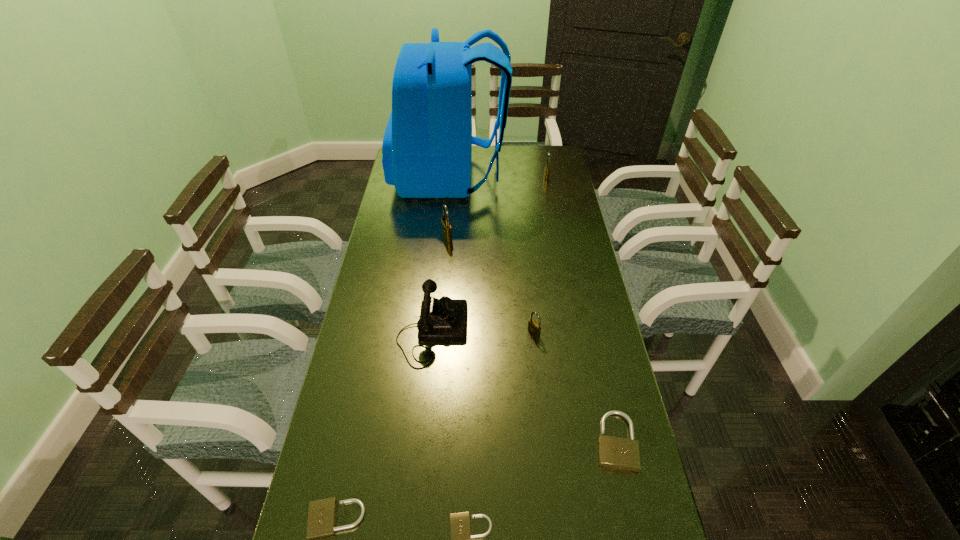
Where is `object at the far left corner`? The height and width of the screenshot is (540, 960). object at the far left corner is located at coordinates (427, 146).

Where is `vacant space at the left edge of the desktop`? This screenshot has width=960, height=540. vacant space at the left edge of the desktop is located at coordinates (388, 303).

Identify the location of free space at the right edge of the desktop. Image resolution: width=960 pixels, height=540 pixels. (543, 195).

You are a GUI agent. You are given a task and a screenshot of the screen. Output one action in this format:
    pyautogui.click(x=<x>, y=<y>)
    Task: Click on the free space that is in between the telephone and the leftmost brass padlock
    
    Given the screenshot: What is the action you would take?
    pyautogui.click(x=440, y=284)

Locate an element on the screen. The height and width of the screenshot is (540, 960). empty space between the third farthest object and the farthest brass padlock is located at coordinates (497, 207).

Find the location of a particular element. This screenshot has height=540, width=960. object that is the second closest to the third farthest padlock is located at coordinates (619, 453).

I want to click on object that can be found as the third closest to the second brass padlock from left to right, so click(446, 226).

Locate an element on the screen. The width and height of the screenshot is (960, 540). padlock that is the third closest to the telephone is located at coordinates (321, 522).

This screenshot has width=960, height=540. What are the coordinates of `padlock that is the fifth closest to the fourth padlock from right to left` in the screenshot? It's located at (547, 166).

Identify which brass padlock is the third nearest to the tallest object. Please provide its 2D coordinates. Your answer should be formatted as a tuple, i.e. [(x, y)], where the tuple contains the x and y coordinates of a point satisfying the conditions above.

[(534, 328)]